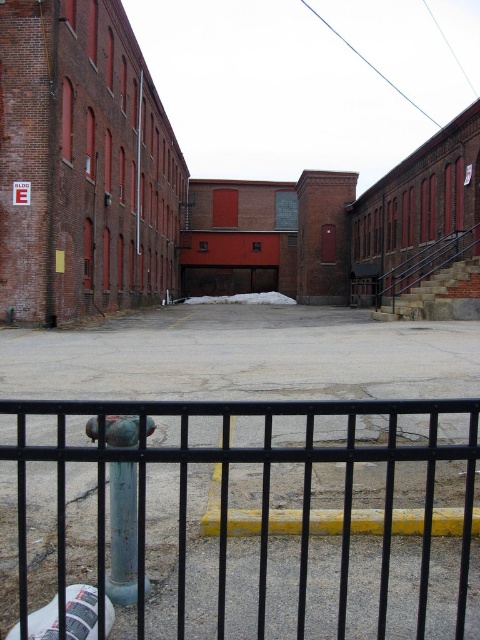
You are a delivery person trying to navigate through the courtyard. You see the black metal fence at lower center and the green patina hydrant at center. Which object is closer to the right side of the courtyard?

The black metal fence at lower center is to the right of the green patina hydrant at center, so the black metal fence at lower center is closer to the right side of the courtyard.

You are a delivery person with a cart that is 1 meter wide. You need to move your cart from the street into the courtyard through the gap between the black metal fence at lower center and the green patina hydrant at center. Can your cart fit through the gap?

The distance between the black metal fence at lower center and the green patina hydrant at center is 65.76 centimeters. Since the cart is 1 meter wide, which is 100 centimeters, the gap is narrower than the cart. Therefore, the cart cannot fit through the gap.

You are a delivery person trying to navigate through the courtyard. You need to pass between the black metal fence at lower center and the green patina hydrant at center. Can you estimate whether the space between them is wide enough for your delivery cart, which is 1.2 meters wide?

The black metal fence at lower center is bigger than the green patina hydrant at center, but the exact distance between them isn